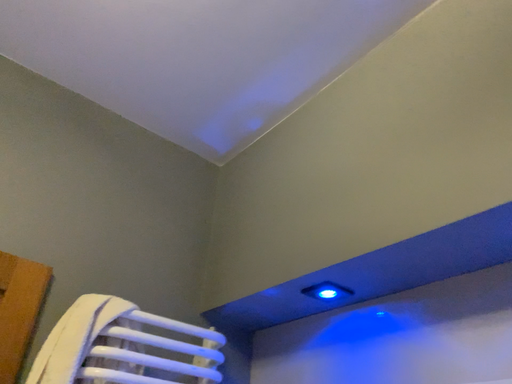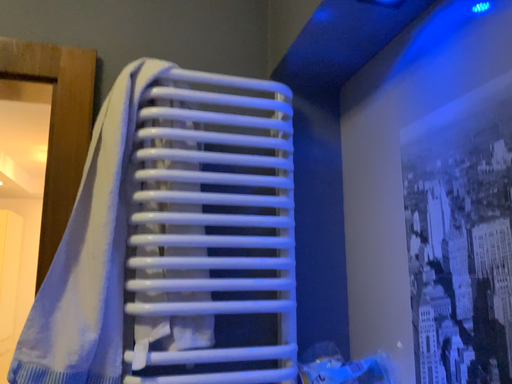
Question: Which way did the camera rotate in the video?

Choices:
 (A) rotated left
 (B) rotated right

Answer: (A)